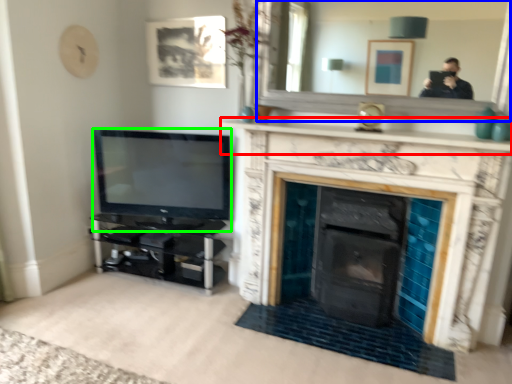
Question: Which object is positioned farthest from mantle (highlighted by a red box)? Select from mirror (highlighted by a blue box) and television (highlighted by a green box).

Choices:
 (A) mirror
 (B) television

Answer: (A)